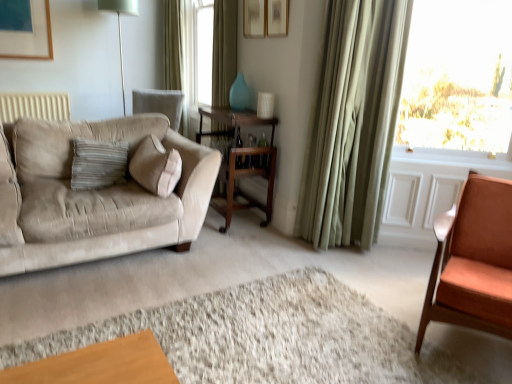
Question: From the image's perspective, is wooden cocktail table at center above wooden table at center?

Choices:
 (A) no
 (B) yes

Answer: (B)

Question: Would you consider wooden cocktail table at center to be distant from wooden table at center?

Choices:
 (A) no
 (B) yes

Answer: (A)

Question: From a real-world perspective, is wooden cocktail table at center located higher than wooden table at center?

Choices:
 (A) yes
 (B) no

Answer: (A)

Question: Is wooden cocktail table at center closer to camera compared to wooden table at center?

Choices:
 (A) yes
 (B) no

Answer: (A)

Question: Can you confirm if wooden cocktail table at center is shorter than wooden table at center?

Choices:
 (A) no
 (B) yes

Answer: (A)

Question: Considering the positions of point (229, 213) and point (165, 0), is point (229, 213) closer or farther from the camera than point (165, 0)?

Choices:
 (A) farther
 (B) closer

Answer: (B)

Question: From a real-world perspective, is wooden cocktail table at center positioned above or below green fabric curtain at upper center, which appears as the 3th curtain when viewed from the front?

Choices:
 (A) above
 (B) below

Answer: (B)

Question: Would you say wooden cocktail table at center is to the left or to the right of green fabric curtain at upper center, which is counted as the 1th curtain, starting from the left, in the picture?

Choices:
 (A) right
 (B) left

Answer: (A)

Question: From the image's perspective, relative to green fabric curtain at upper center, marked as the third curtain in a right-to-left arrangement, is wooden cocktail table at center above or below?

Choices:
 (A) above
 (B) below

Answer: (B)

Question: Would you say metallic silver table lamp at upper left is inside or outside matte orange chair at right?

Choices:
 (A) inside
 (B) outside

Answer: (B)

Question: Is metallic silver table lamp at upper left to the left or to the right of matte orange chair at right in the image?

Choices:
 (A) left
 (B) right

Answer: (A)

Question: In terms of height, does metallic silver table lamp at upper left look taller or shorter compared to matte orange chair at right?

Choices:
 (A) tall
 (B) short

Answer: (A)

Question: Considering the positions of metallic silver table lamp at upper left and matte orange chair at right in the image, is metallic silver table lamp at upper left bigger or smaller than matte orange chair at right?

Choices:
 (A) big
 (B) small

Answer: (B)

Question: In the image, is wooden table at center positioned in front of or behind matte white picture frame at upper center?

Choices:
 (A) front
 (B) behind

Answer: (B)

Question: Is point (254, 203) positioned closer to the camera than point (286, 1)?

Choices:
 (A) closer
 (B) farther

Answer: (B)